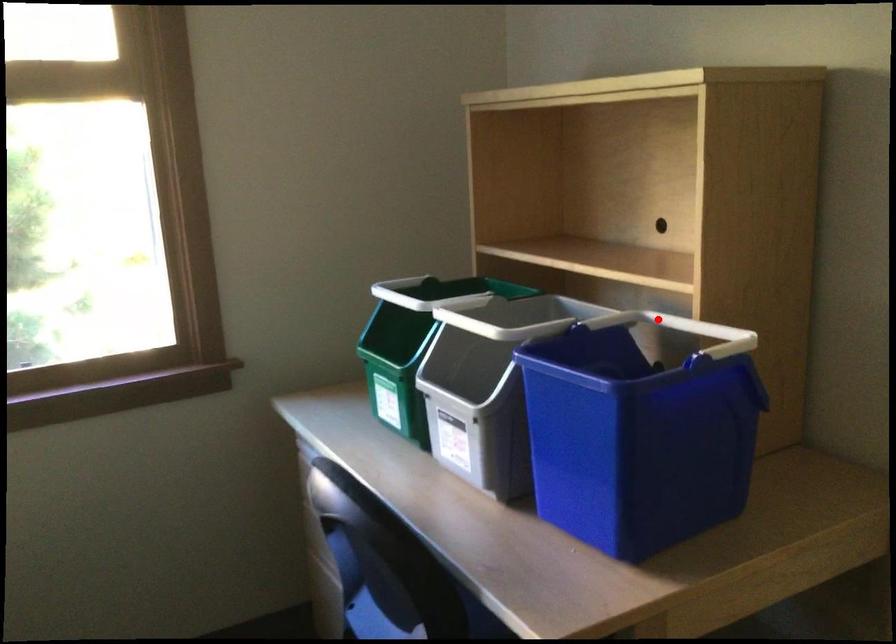
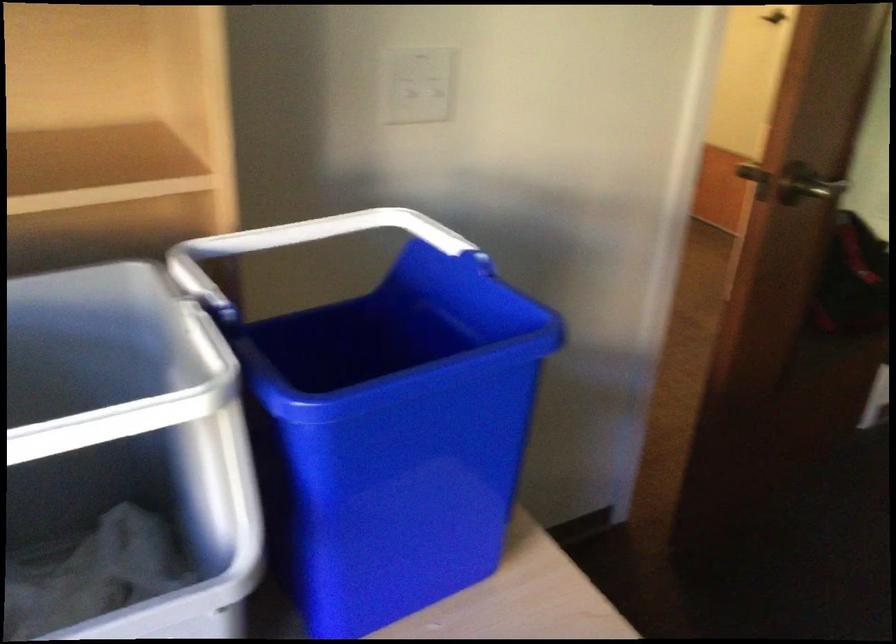
Question: I am providing you with two images of the same scene from different viewpoints. A red point is shown in image1. For the corresponding object point in image2, is it positioned nearer or farther from the camera?

Choices:
 (A) Nearer
 (B) Farther

Answer: (A)